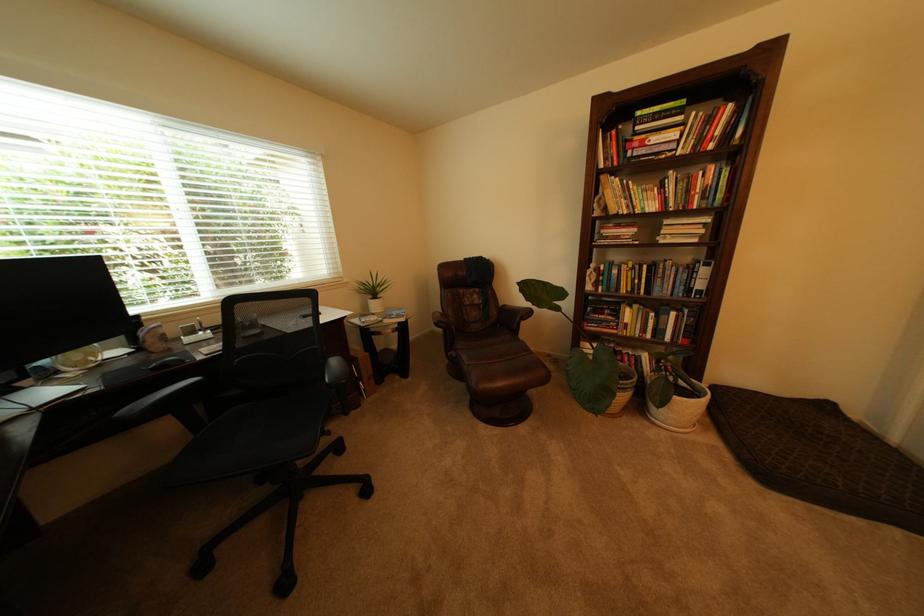
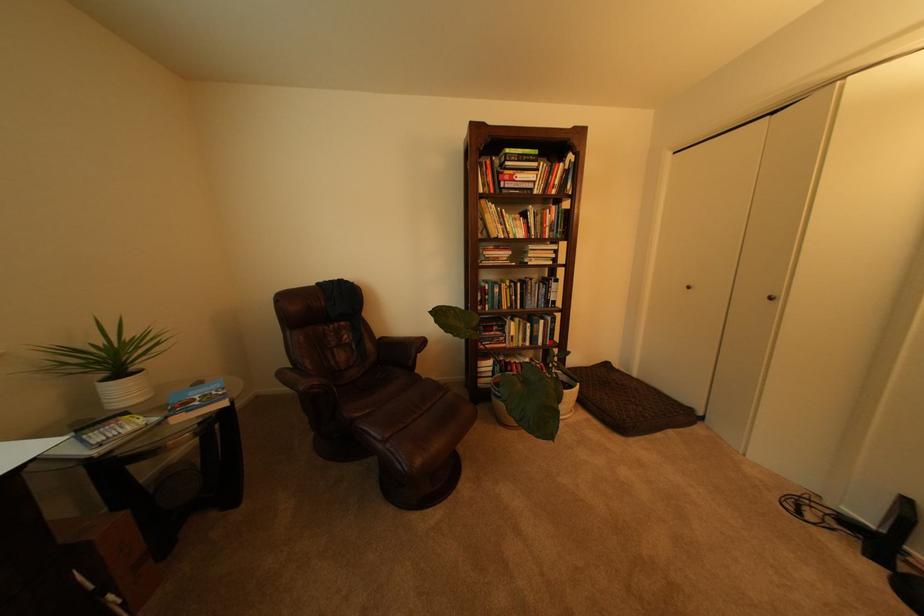
Where in the second image is the point corresponding to the point at 677,274 from the first image?

(543, 290)